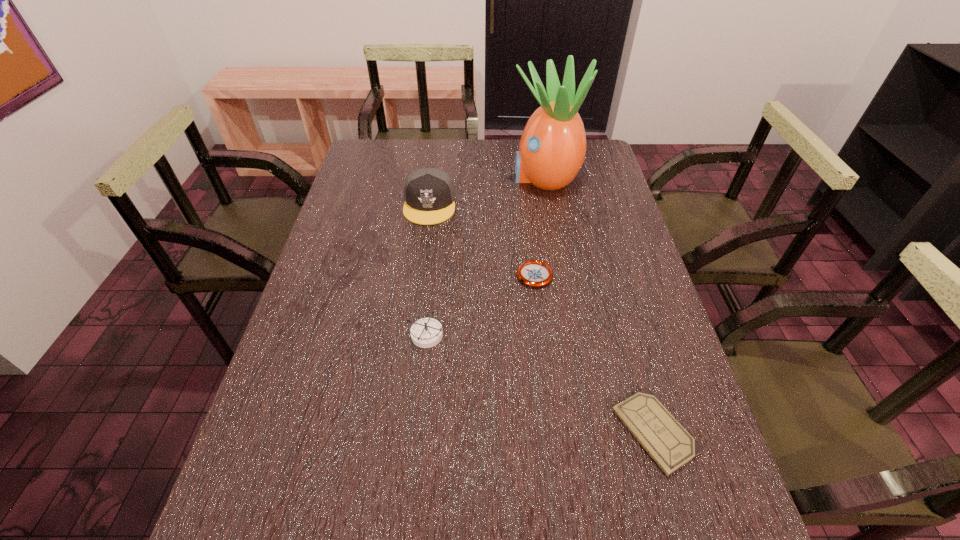
Where is `blank space at the left edge of the desktop`? The image size is (960, 540). blank space at the left edge of the desktop is located at coordinates (350, 263).

The image size is (960, 540). What are the coordinates of `free space at the right edge of the desktop` in the screenshot? It's located at (641, 333).

In the image, there is a desktop. Where is `vacant space at the far right corner`? vacant space at the far right corner is located at coordinates (589, 157).

Locate an element on the screen. The image size is (960, 540). vacant area that lies between the third farthest object and the shortest object is located at coordinates (595, 353).

The width and height of the screenshot is (960, 540). I want to click on free point between the nearest object and the third tallest object, so click(x=540, y=383).

In order to click on vacant space in between the pineapple and the checkbook in this screenshot , I will do `click(600, 304)`.

This screenshot has width=960, height=540. In order to click on free spot between the second shortest object and the left compass in this screenshot , I will do `click(480, 305)`.

Where is `vacant point located between the cap and the tallest object`? vacant point located between the cap and the tallest object is located at coordinates (487, 191).

Locate an element on the screen. This screenshot has width=960, height=540. empty location between the tallest object and the third farthest object is located at coordinates (540, 226).

At what (x,y) coordinates should I click in order to perform the action: click on free area in between the right compass and the second nearest object. Please return your answer as a coordinate pair (x, y). Looking at the image, I should click on (480, 305).